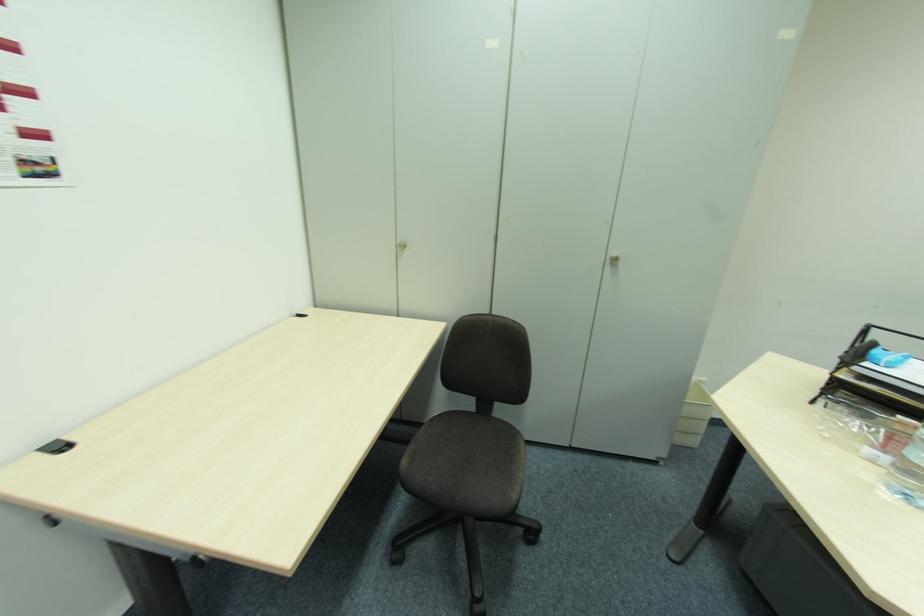
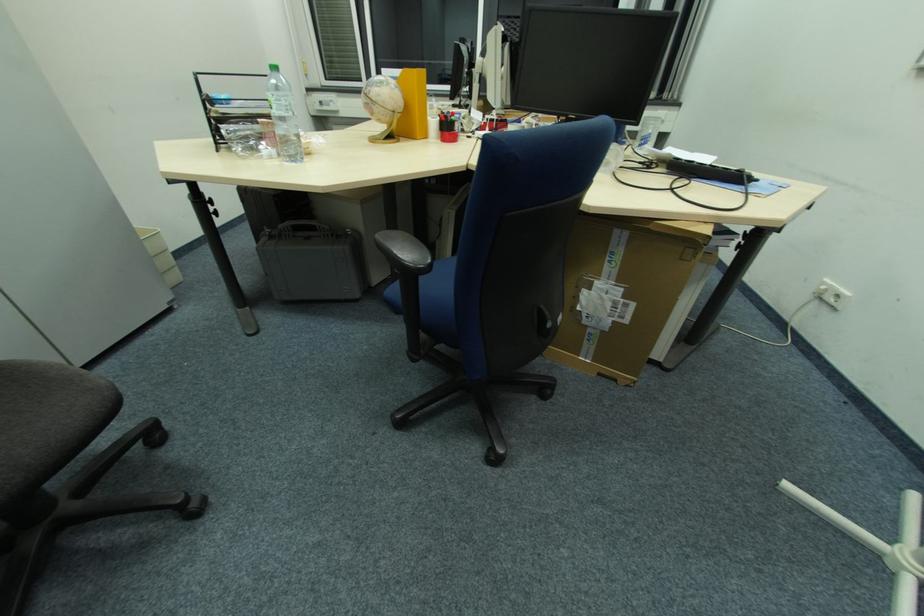
First-person continuous shooting, in which direction is the camera rotating?

The camera's rotation is toward right-down.